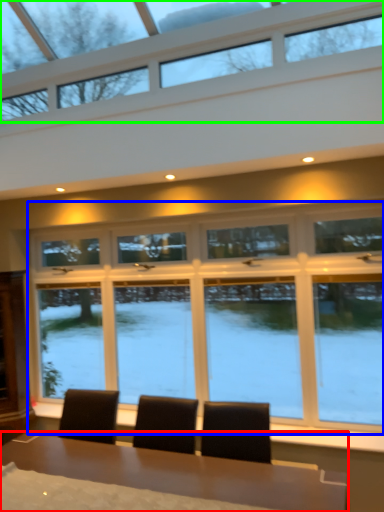
Question: Estimate the real-world distances between objects in this image. Which object is closer to table (highlighted by a red box), window (highlighted by a blue box) or window (highlighted by a green box)?

Choices:
 (A) window
 (B) window

Answer: (A)